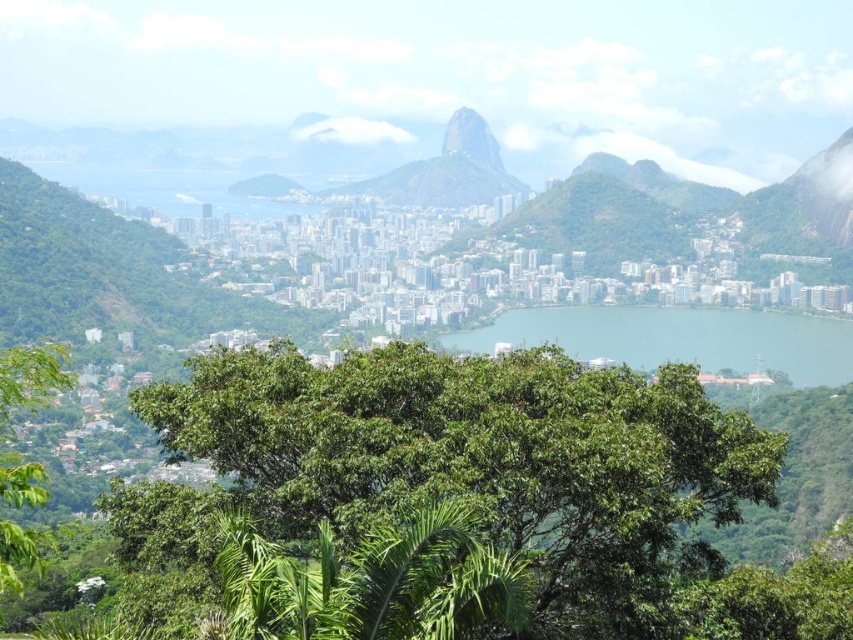
You are an urban planner assessing the city layout. Based on the scene, which object, the blue water at center or the green textured mountain at center, is positioned closer to the city center?

The blue water at center is closer to the viewer than the green textured mountain at center, so the blue water at center is positioned closer to the city center.

You are a drone operator trying to capture a photo of the city from above. Your drone is currently hovering at point 0.5, 0.8. To avoid flying over the blue water at center, which direction should you move the drone? Please answer with either North, South, East, or West.

The blue water at center is located at point (677,339). Since your drone is at (682,320), it is slightly north and west of the blue water. To avoid flying over it, move the drone further north or east.

You are a city planner analyzing the layout of this area. Given the presence of the blue water at center and the green rock formation at center, which one has a greater horizontal spread in the image?

The blue water at center has a larger width than the green rock formation at center, so it has a greater horizontal spread.